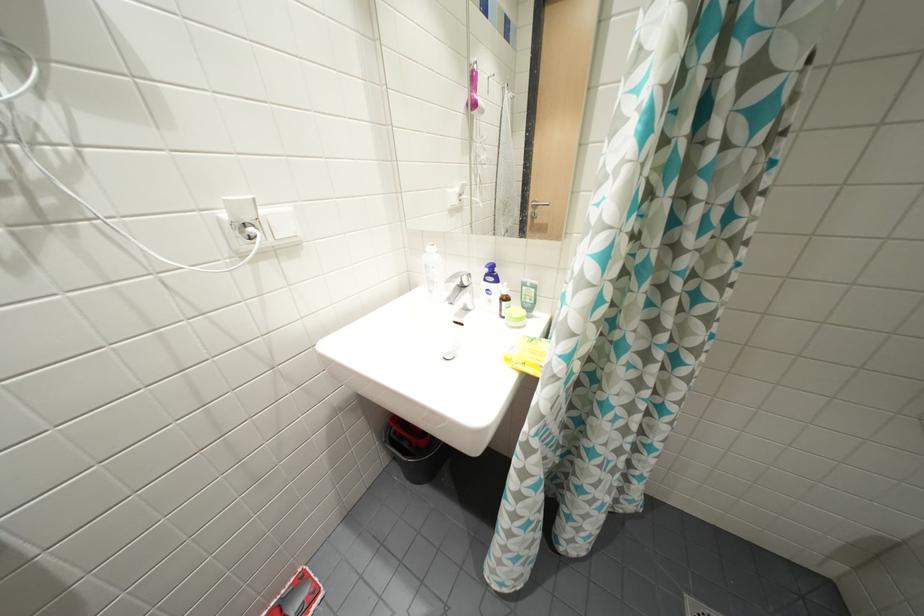
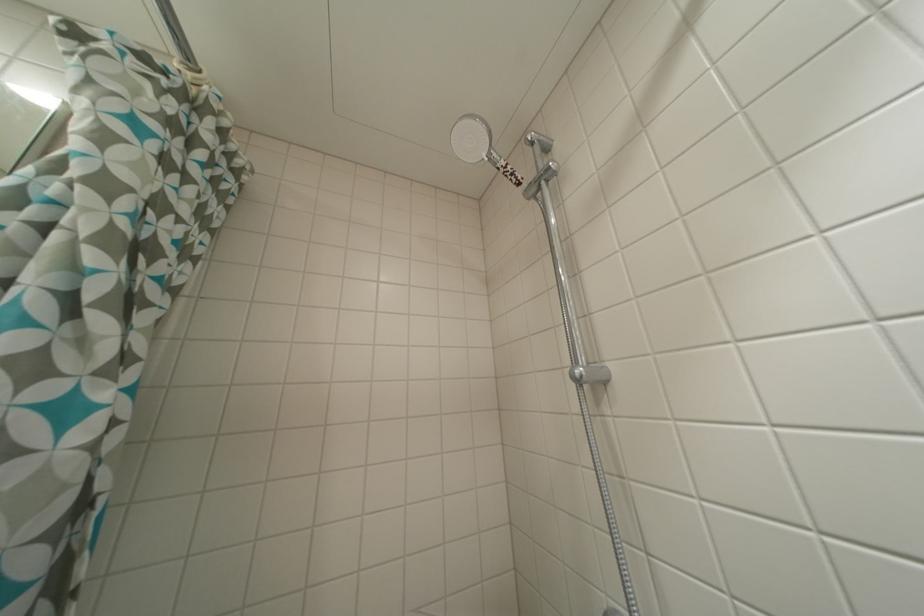
Based on the continuous images, in which direction is the camera rotating?

The rotation direction of the camera is right-up.